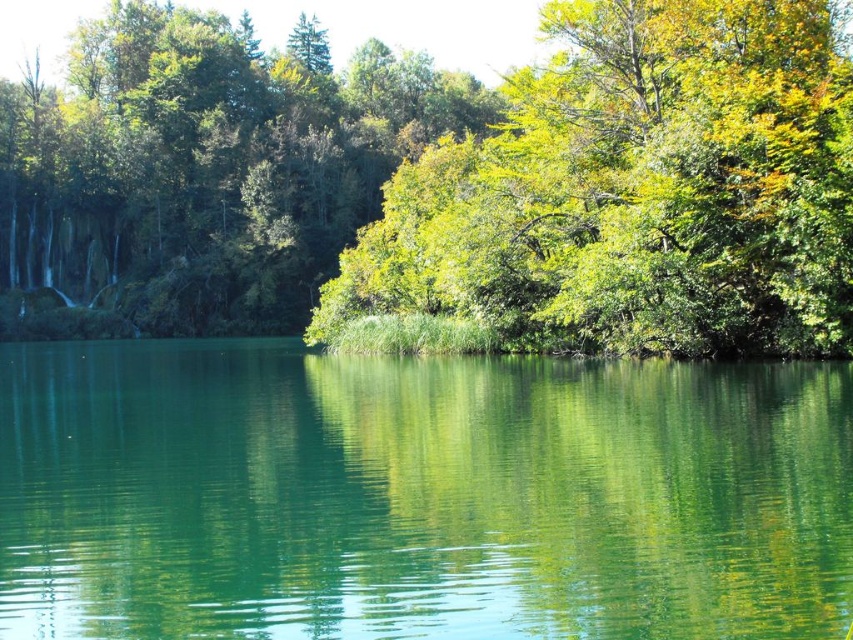
Is green leafy tree at center wider than green smooth water at center?

Correct, the width of green leafy tree at center exceeds that of green smooth water at center.

Describe the element at coordinates (445, 182) in the screenshot. I see `green leafy tree at center` at that location.

Locate an element on the screen. green leafy tree at center is located at coordinates (445, 182).